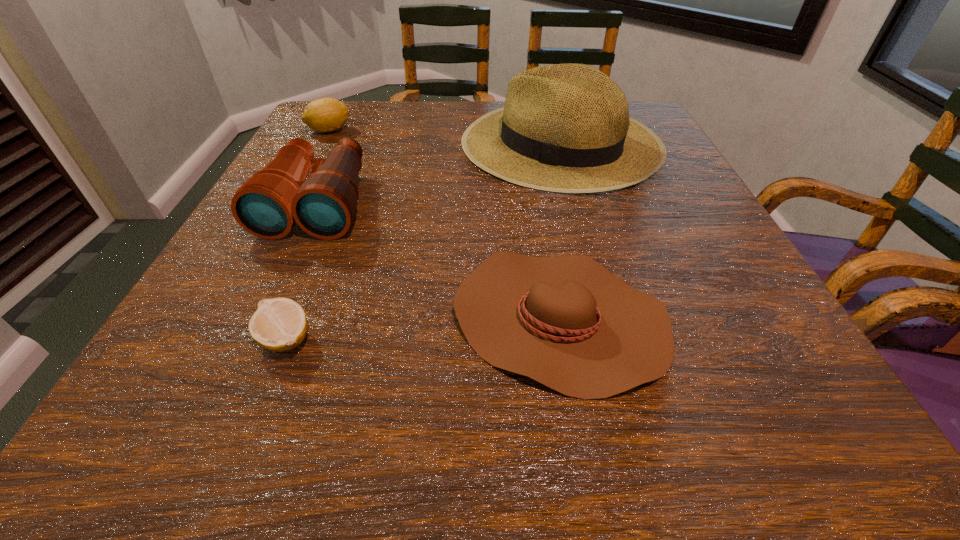
The width and height of the screenshot is (960, 540). Find the location of `blank area in the image that satisfies the following two spatial constraints: 1. on the back side of the sunhat; 2. at the stem end of the third shortest object`. blank area in the image that satisfies the following two spatial constraints: 1. on the back side of the sunhat; 2. at the stem end of the third shortest object is located at coordinates (557, 130).

The width and height of the screenshot is (960, 540). I want to click on free point that satisfies the following two spatial constraints: 1. at the stem end of the taller lemon; 2. on the left side of the cowboy hat, so click(x=228, y=318).

Identify the location of blank space that satisfies the following two spatial constraints: 1. at the stem end of the left lemon; 2. on the left side of the nearer lemon. This screenshot has width=960, height=540. (217, 339).

Where is `vacant position in the image that satisfies the following two spatial constraints: 1. at the stem end of the right lemon; 2. on the left side of the taller lemon`? This screenshot has width=960, height=540. vacant position in the image that satisfies the following two spatial constraints: 1. at the stem end of the right lemon; 2. on the left side of the taller lemon is located at coordinates (217, 339).

The height and width of the screenshot is (540, 960). I want to click on free location that satisfies the following two spatial constraints: 1. at the stem end of the shorter lemon; 2. on the left side of the left lemon, so click(x=217, y=339).

You are a GUI agent. You are given a task and a screenshot of the screen. Output one action in this format:
    pyautogui.click(x=<x>, y=<y>)
    Task: Click on the free point that satisfies the following two spatial constraints: 1. at the stem end of the farther lemon; 2. on the left side of the fourth tallest object
    The image size is (960, 540).
    Given the screenshot: What is the action you would take?
    (228, 318)

The height and width of the screenshot is (540, 960). Find the location of `free location that satisfies the following two spatial constraints: 1. at the stem end of the farther lemon; 2. on the left side of the sunhat`. free location that satisfies the following two spatial constraints: 1. at the stem end of the farther lemon; 2. on the left side of the sunhat is located at coordinates (323, 144).